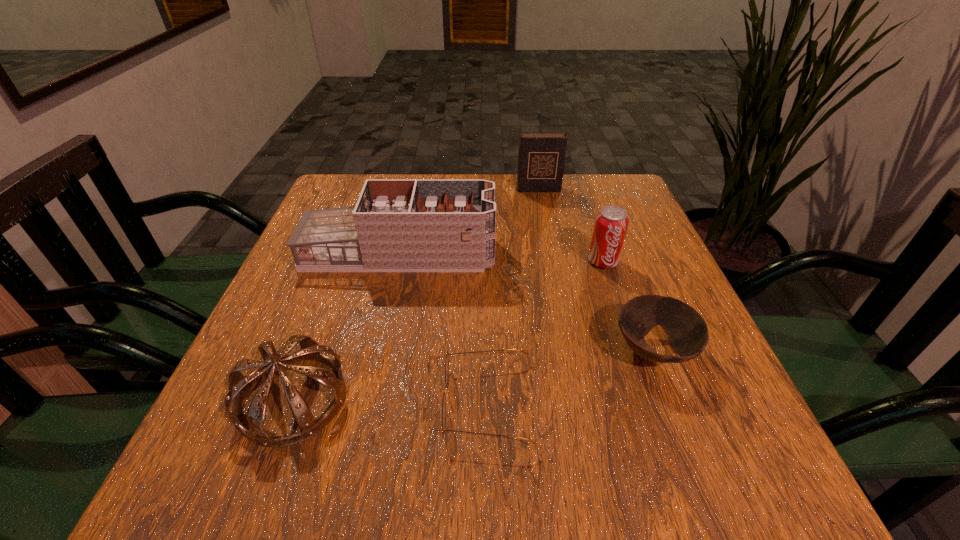
What are the coordinates of `vacant area situated on the back of the tiara` in the screenshot? It's located at (354, 231).

At what (x,y) coordinates should I click in order to perform the action: click on free space located on the front of the bowl. Please return your answer as a coordinate pair (x, y). This screenshot has width=960, height=540. Looking at the image, I should click on (692, 455).

Where is `vacant space located 0.330m on the temples of the shortest object`? vacant space located 0.330m on the temples of the shortest object is located at coordinates [x=235, y=402].

Find the location of a particular element. This screenshot has height=540, width=960. vacant area situated 0.100m on the temples of the shortest object is located at coordinates (379, 402).

Identify the location of vacant space located on the temples of the shortest object. (379, 402).

This screenshot has width=960, height=540. I want to click on object situated at the far edge, so click(x=541, y=159).

Find the location of a particular element. The image size is (960, 540). tiara that is at the near edge is located at coordinates (238, 384).

You are a GUI agent. You are given a task and a screenshot of the screen. Output one action in this format:
    pyautogui.click(x=<x>, y=<y>)
    Task: Click on the spectacles located in the near edge section of the desktop
    The width and height of the screenshot is (960, 540).
    Given the screenshot: What is the action you would take?
    pyautogui.click(x=446, y=368)

I want to click on dollhouse situated at the left edge, so click(x=405, y=225).

This screenshot has width=960, height=540. I want to click on tiara located in the left edge section of the desktop, so click(238, 384).